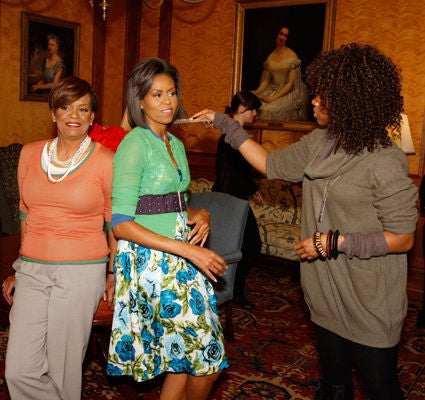
I want to click on lampshade, so click(406, 138).